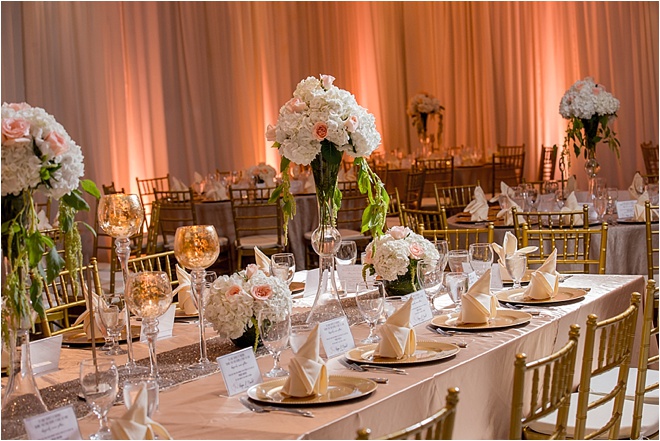
The height and width of the screenshot is (441, 660). I want to click on tablecloths, so click(257, 425), click(627, 246), click(477, 173), click(214, 215).